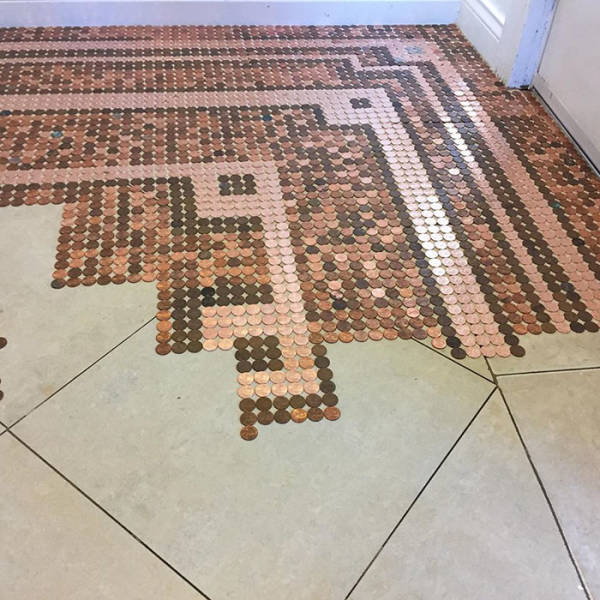
Find the location of `floor tile`. floor tile is located at coordinates (297, 508).